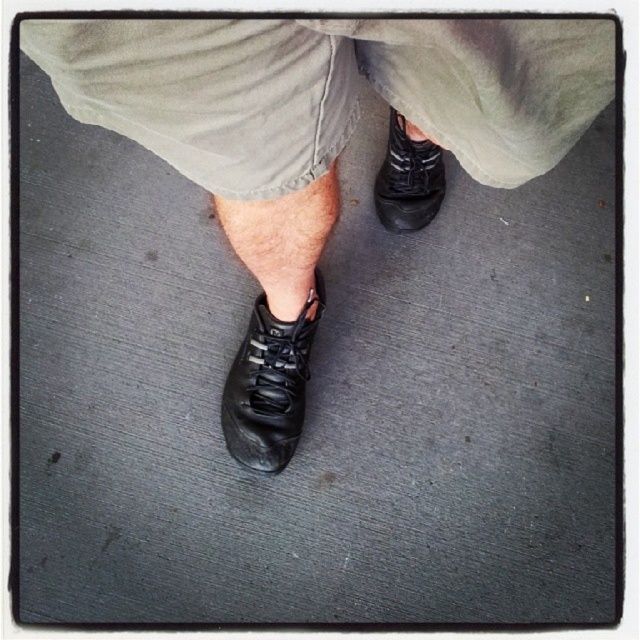
Question: Which object appears closest to the camera in this image?

Choices:
 (A) black leather shoe at center
 (B) matte khaki shorts at center
 (C) matte black shoe at lower center
 (D) black leather shoe at lower left

Answer: (B)

Question: From the image, what is the correct spatial relationship of black leather shoe at lower left in relation to matte black shoe at lower center?

Choices:
 (A) left
 (B) right

Answer: (A)

Question: Which point is farther from the camera taking this photo?

Choices:
 (A) (310, 304)
 (B) (424, 93)
 (C) (440, 176)
 (D) (301, 392)

Answer: (C)

Question: Considering the relative positions of matte khaki shorts at center and black leather shoe at lower left in the image provided, where is matte khaki shorts at center located with respect to black leather shoe at lower left?

Choices:
 (A) left
 (B) right

Answer: (B)

Question: Is matte khaki shorts at center wider than matte black shoe at lower center?

Choices:
 (A) yes
 (B) no

Answer: (A)

Question: Which object is positioned closest to the matte black shoe at lower center?

Choices:
 (A) matte khaki shorts at center
 (B) black leather shoe at center

Answer: (B)